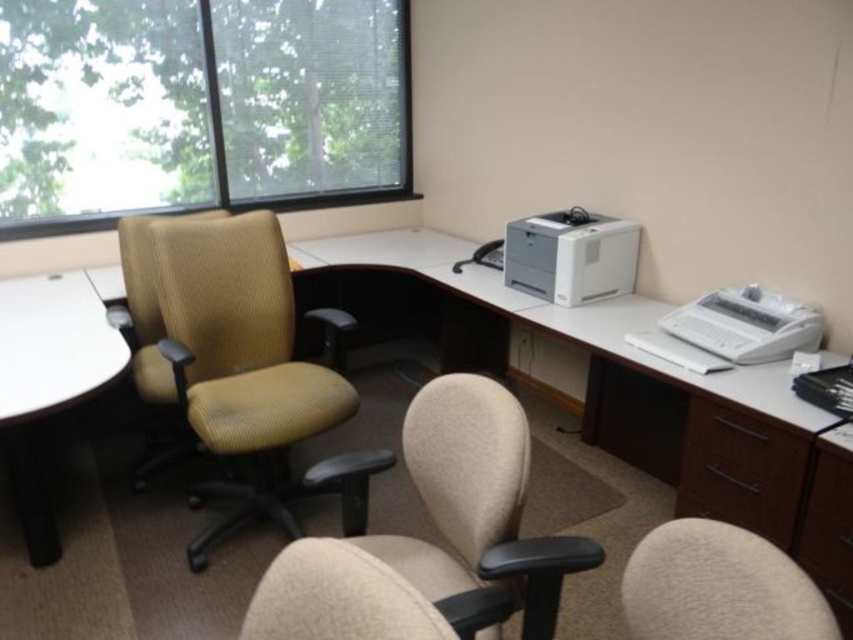
You are standing at the origin point of the office space. There are two points marked in the image, point (x=45, y=81) and point (x=723, y=420). Which point is closer to you?

Point (x=45, y=81) is behind point (x=723, y=420), so point (x=723, y=420) is closer to you.

You are an office worker who needs to move a new printer to the white matte round table at left. Given that the printer is 1 meter wide, can you fit it on the table without overlapping the edges?

The white matte round table at left has a diameter of 1.2 meters, so the printer, which is 1 meter wide, can fit on the table with some space to spare.

You are standing at the point marked as point (x=408, y=154) in the office. If you want to take a photo of the entire room, would you need to move closer or farther away from the current position?

The point (x=408, y=154) is 13.28 feet away from the camera. To capture the entire room in a photo, you would likely need to move farther away to ensure the entire space fits within the camera frame.